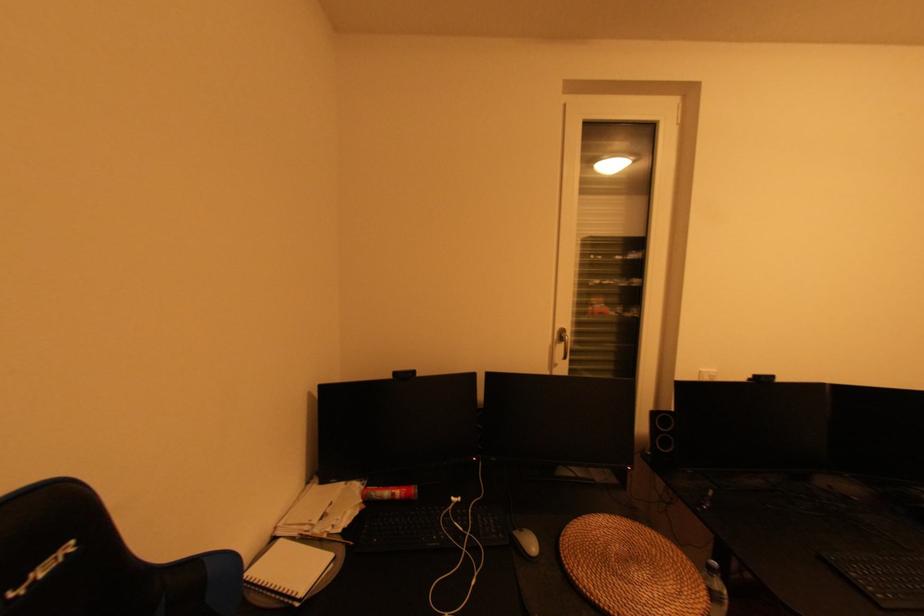
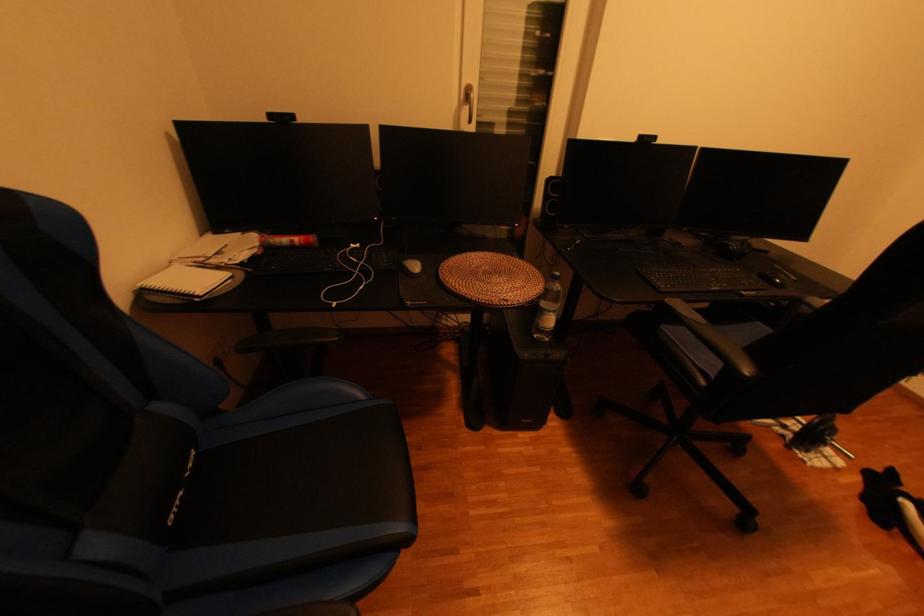
Locate, in the second image, the point that corresponds to pixel 460 501 in the first image.

(359, 246)